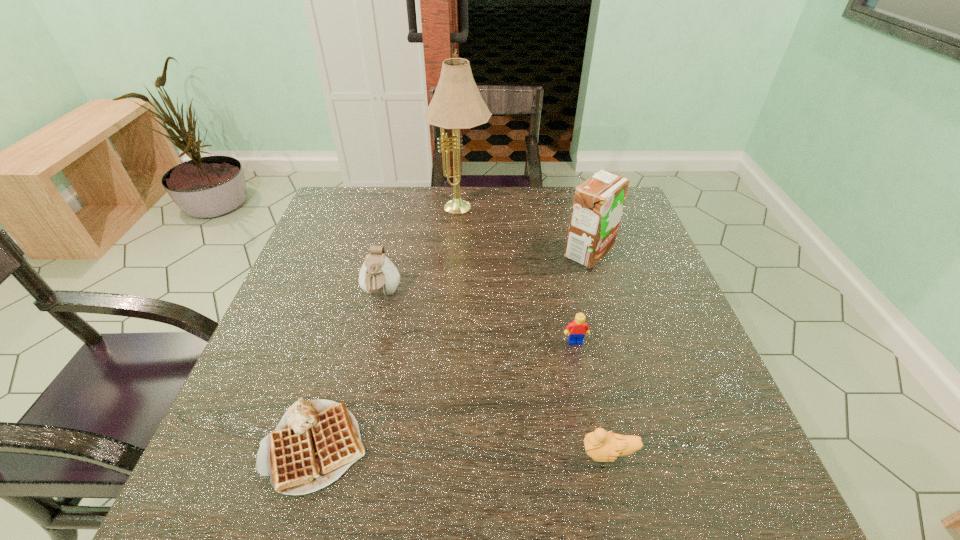
Identify the location of the tallest object. (457, 104).

This screenshot has width=960, height=540. I want to click on the farthest object, so click(x=457, y=104).

Identify the location of the fifth nearest object. (598, 202).

Where is `the second tallest object`? the second tallest object is located at coordinates (598, 202).

Image resolution: width=960 pixels, height=540 pixels. Identify the location of the third tallest object. (378, 276).

Locate an element on the screen. The image size is (960, 540). pouch is located at coordinates tap(378, 276).

Identify the location of the fourth farthest object. The height and width of the screenshot is (540, 960). (578, 328).

Where is `duckling`? The height and width of the screenshot is (540, 960). duckling is located at coordinates (601, 446).

This screenshot has width=960, height=540. In order to click on the shortest object in this screenshot , I will do `click(316, 441)`.

Find the location of a particular element. This screenshot has height=540, width=960. vacant space situated on the right of the farthest object is located at coordinates (523, 210).